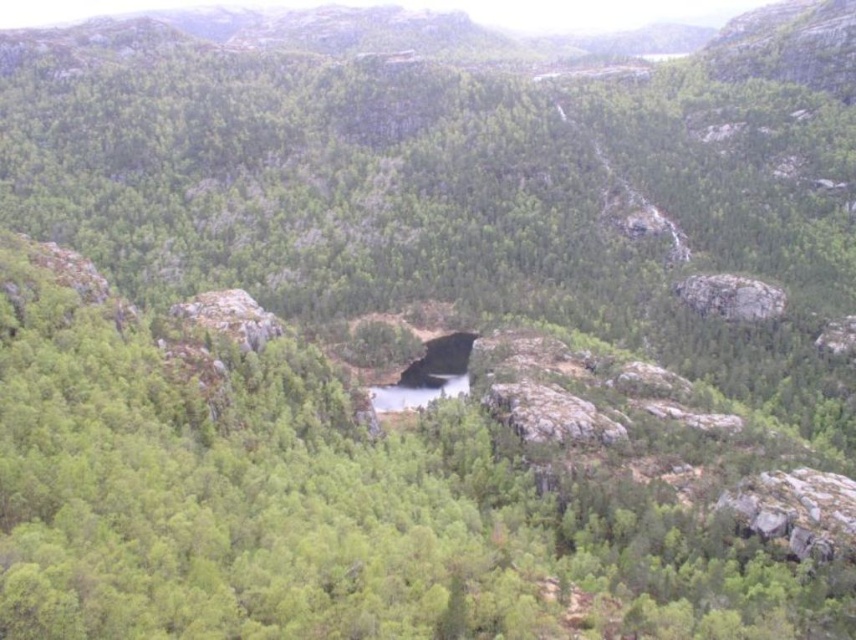
Is green matte tree at center smaller than rough gray rock at upper right?

No.

Is green matte tree at center to the left of rough gray rock at upper right from the viewer's perspective?

Yes, green matte tree at center is to the left of rough gray rock at upper right.

Between point (355, 486) and point (738, 282), which one is positioned behind?

The point (738, 282) is behind.

I want to click on green matte tree at center, so click(x=308, y=504).